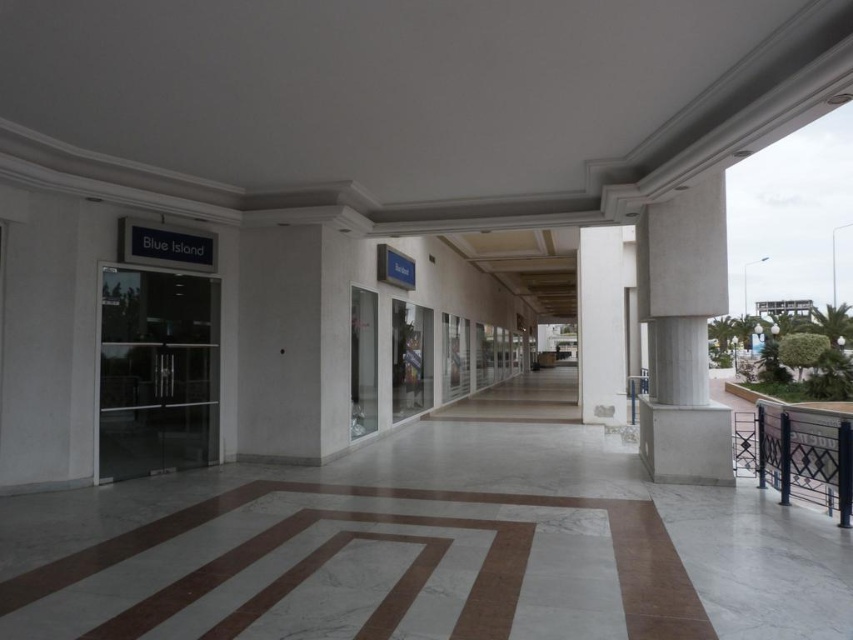
Question: Does white marble pillar at right appear under black metal balustrade at lower right?

Choices:
 (A) yes
 (B) no

Answer: (B)

Question: Does white marble pillar at right have a smaller size compared to black metal balustrade at lower right?

Choices:
 (A) yes
 (B) no

Answer: (B)

Question: Among these objects, which one is farthest from the camera?

Choices:
 (A) black metal balustrade at lower right
 (B) white marble pillar at right

Answer: (B)

Question: Is white marble pillar at right thinner than white marble pillar at center?

Choices:
 (A) yes
 (B) no

Answer: (B)

Question: Which object is farther from the camera taking this photo?

Choices:
 (A) white marble pillar at right
 (B) white marble pillar at center

Answer: (B)

Question: Estimate the real-world distances between objects in this image. Which object is closer to the white marble pillar at center?

Choices:
 (A) black metal balustrade at lower right
 (B) white marble pillar at right

Answer: (B)